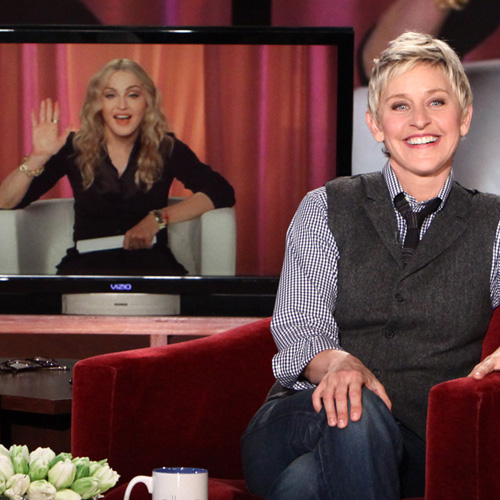
Where is `red pink and orange curtain background`? This screenshot has height=500, width=500. red pink and orange curtain background is located at coordinates (259, 97).